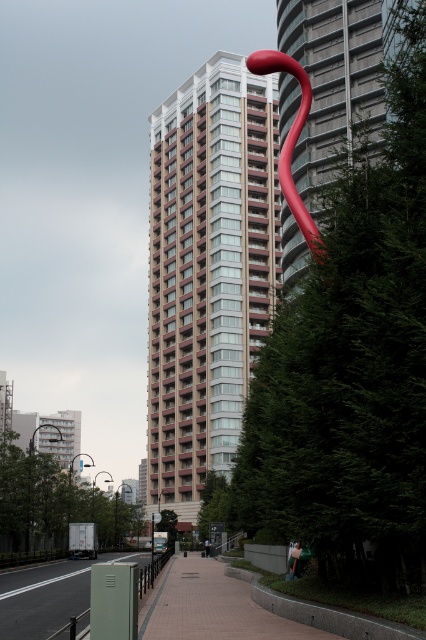
Question: Does green matte pavement at lower left have a greater width compared to rubber-like red sculpture at upper center?

Choices:
 (A) yes
 (B) no

Answer: (A)

Question: Considering the relative positions of green matte pavement at lower left and rubber-like red sculpture at upper center in the image provided, where is green matte pavement at lower left located with respect to rubber-like red sculpture at upper center?

Choices:
 (A) below
 (B) above

Answer: (A)

Question: Which object is the closest to the green matte pavement at lower left?

Choices:
 (A) tiled pavement at center
 (B) rubber-like red sculpture at upper center

Answer: (A)

Question: Does tiled pavement at center appear on the left side of rubber-like red sculpture at upper center?

Choices:
 (A) no
 (B) yes

Answer: (B)

Question: Which object appears closest to the camera in this image?

Choices:
 (A) green matte pavement at lower left
 (B) tiled pavement at center
 (C) rubber-like red sculpture at upper center

Answer: (B)

Question: Which point is farther to the camera?

Choices:
 (A) green matte pavement at lower left
 (B) tiled pavement at center

Answer: (A)